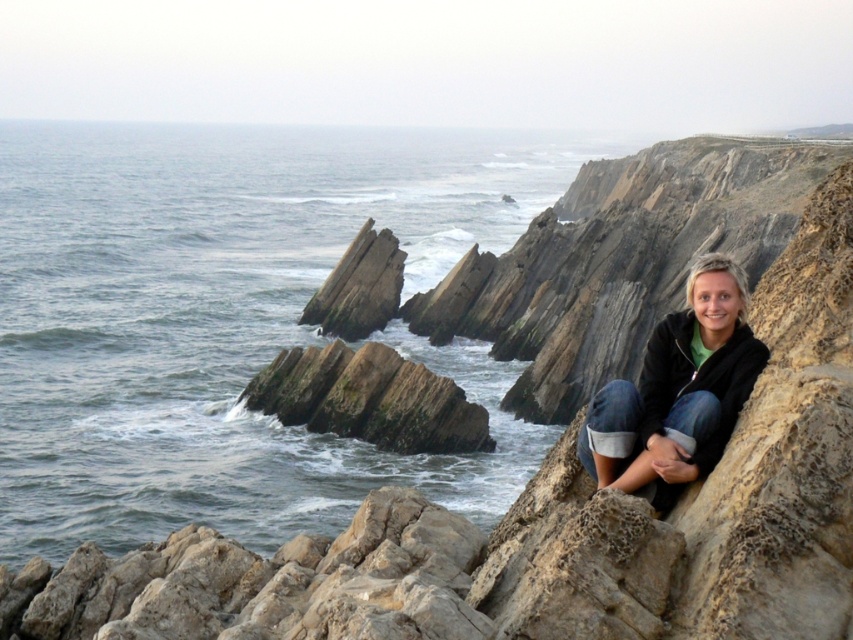
Looking at this image, does blue-green water at center appear under denim jacket at lower right?

No, blue-green water at center is not below denim jacket at lower right.

Is blue-green water at center closer to camera compared to denim jacket at lower right?

No, it is not.

Between point (398, 211) and point (674, 486), which one is positioned behind?

The point (398, 211) is behind.

Find the location of a particular element. blue-green water at center is located at coordinates (231, 320).